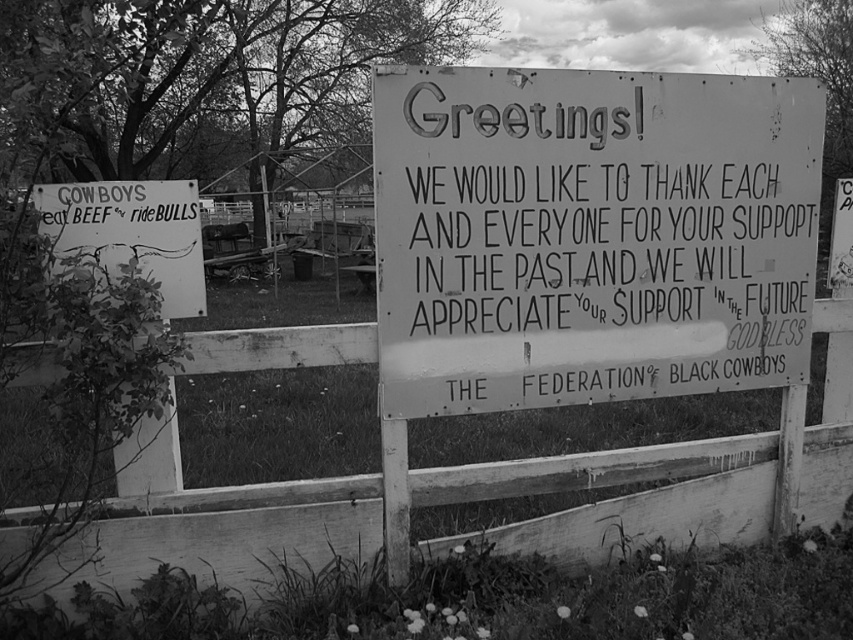
Based on the scene description, what are the coordinates of the white wooden fence at center?

The white wooden fence at center is located at coordinates point (480, 499).

You are a visitor at a rural area and see two signs on a fence. One is the white paper sign at center and the other is the rusty metal signboard at left. Which sign is located higher up on the fence?

The rusty metal signboard at left is located higher up on the fence because the white paper sign at center is positioned under it.